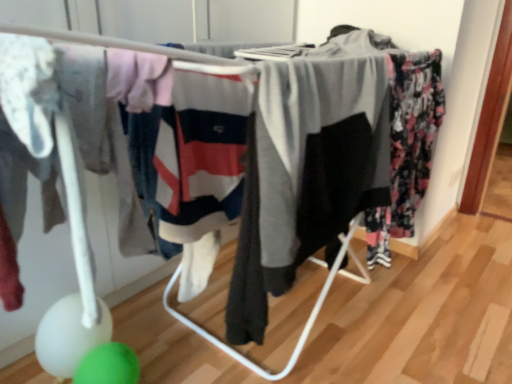
Find the location of a particular element. Image resolution: width=512 pixels, height=384 pixels. spots to the right of white glossy balloon at lower left is located at coordinates (158, 347).